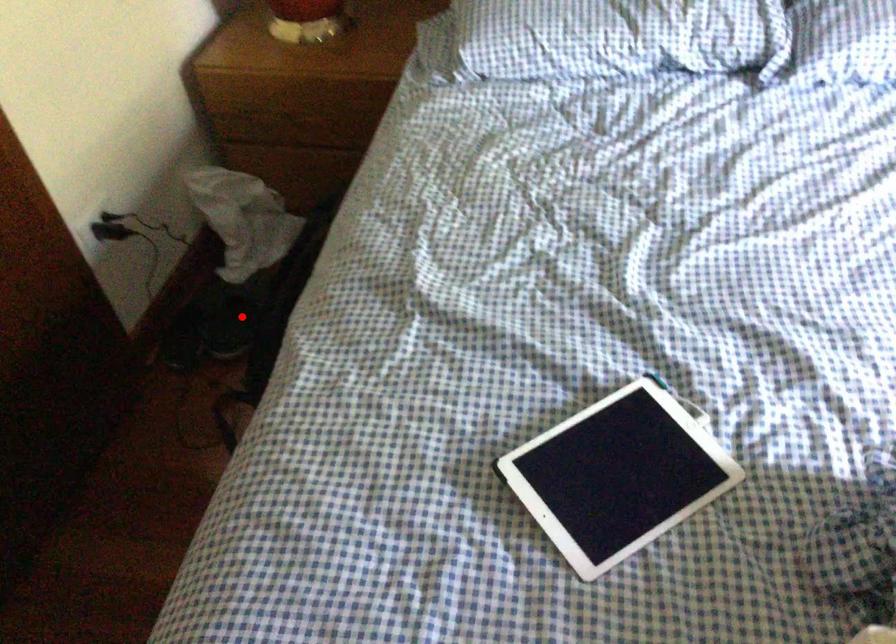
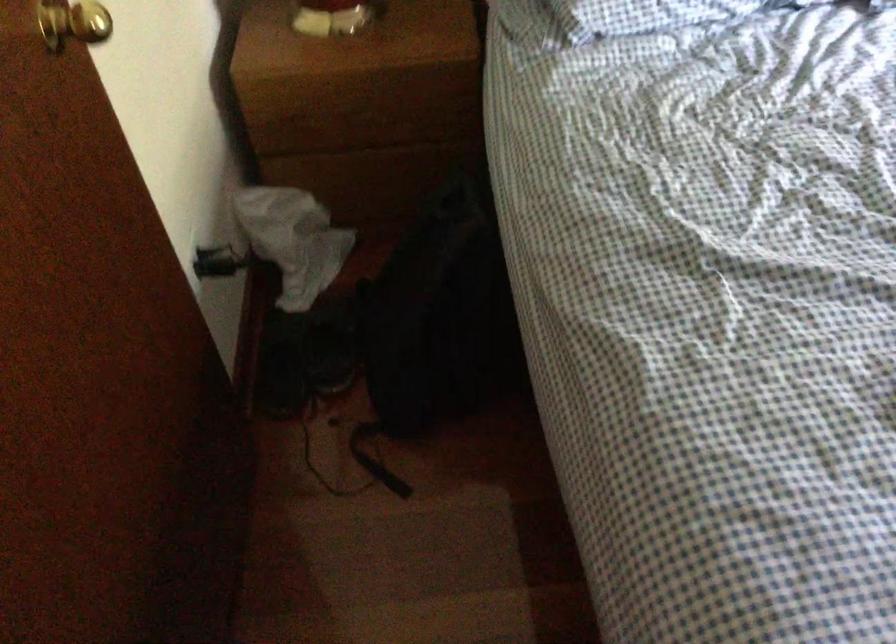
Question: I am providing you with two images of the same scene from different viewpoints. In image1, a red point is highlighted. Considering the same 3D point in image2, which of the following is correct?

Choices:
 (A) It is closer
 (B) It is farther

Answer: (A)